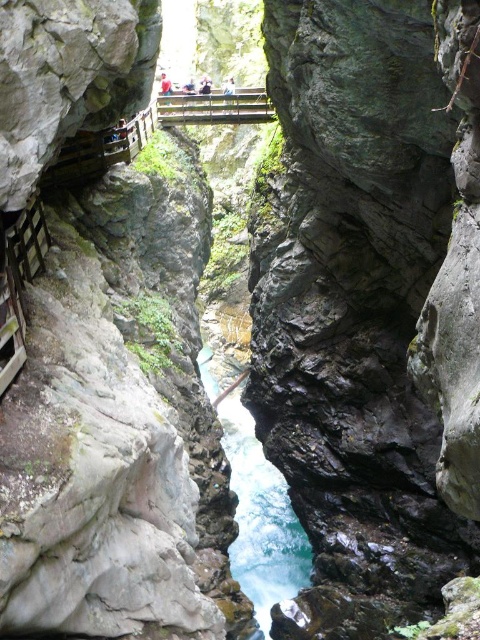
Question: Does blue translucent water at center come in front of wooden at center?

Choices:
 (A) no
 (B) yes

Answer: (B)

Question: Considering the relative positions of blue translucent water at center and wooden at center in the image provided, where is blue translucent water at center located with respect to wooden at center?

Choices:
 (A) above
 (B) below

Answer: (B)

Question: Which of the following is the closest to the observer?

Choices:
 (A) wooden at center
 (B) blue translucent water at center

Answer: (B)

Question: Can you confirm if blue translucent water at center is thinner than wooden at center?

Choices:
 (A) no
 (B) yes

Answer: (A)